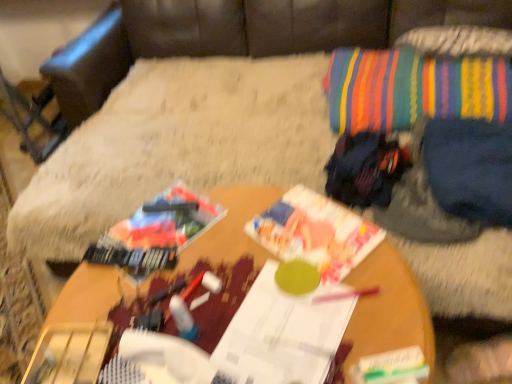
This screenshot has width=512, height=384. I want to click on free spot above printed paper magazine at center, positioned as the 1th magazine in top-to-bottom order (from a real-world perspective), so click(314, 234).